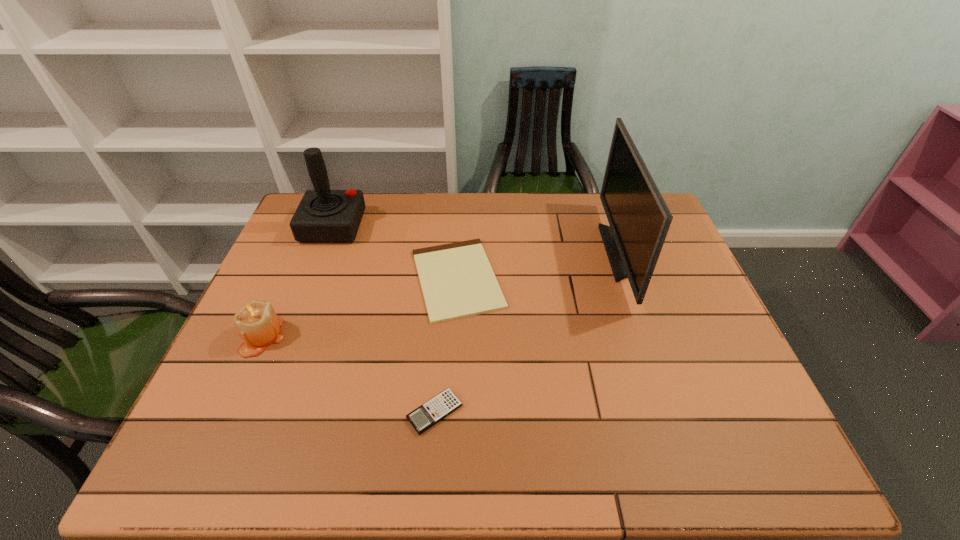
Where is `object that is at the far right corner`? This screenshot has height=540, width=960. object that is at the far right corner is located at coordinates (639, 218).

Find the location of `vacant space at the far edge of the desktop`. vacant space at the far edge of the desktop is located at coordinates [523, 196].

Image resolution: width=960 pixels, height=540 pixels. I want to click on free region at the near edge of the desktop, so click(428, 444).

You are a GUI agent. You are given a task and a screenshot of the screen. Output one action in this format:
    pyautogui.click(x=<x>, y=<y>)
    Task: Click on the vacant space at the left edge of the desktop
    
    Given the screenshot: What is the action you would take?
    pyautogui.click(x=288, y=246)

Locate an element on the screen. The height and width of the screenshot is (540, 960). blank area at the right edge is located at coordinates (721, 403).

At what (x,y) coordinates should I click in order to perform the action: click on free spot at the near right corner of the desktop. Please return your answer as a coordinate pair (x, y). This screenshot has width=960, height=540. Looking at the image, I should click on (777, 446).

Find the location of a particular element. Image resolution: width=960 pixels, height=540 pixels. unoccupied area between the third shortest object and the joystick is located at coordinates (298, 281).

Locate an element on the screen. This screenshot has height=540, width=960. free space between the calculator and the joystick is located at coordinates (384, 319).

Locate an element on the screen. The image size is (960, 540). vacant area that lies between the fourth shortest object and the clipboard is located at coordinates (396, 253).

What are the coordinates of `free area in between the third shortest object and the clipboard` in the screenshot? It's located at (359, 307).